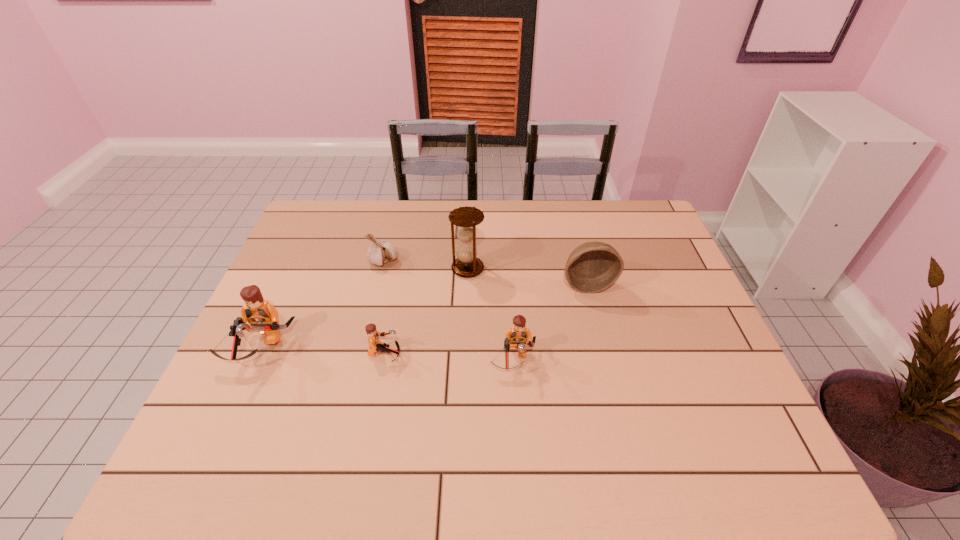
The image size is (960, 540). In order to click on free area in between the fifth object from left to right and the garlic in this screenshot , I will do `click(448, 310)`.

Locate an element on the screen. object that can be found as the fourth closest to the second tallest Lego is located at coordinates (380, 252).

Image resolution: width=960 pixels, height=540 pixels. In order to click on the second closest object to the second Lego from left to right in this screenshot , I will do `click(518, 334)`.

You are a GUI agent. You are given a task and a screenshot of the screen. Output one action in this format:
    pyautogui.click(x=<x>, y=<y>)
    Task: Click on the second closest Lego relative to the fifth object from left to right
    Image resolution: width=960 pixels, height=540 pixels.
    Given the screenshot: What is the action you would take?
    pyautogui.click(x=263, y=317)

You are a GUI agent. You are given a task and a screenshot of the screen. Output one action in this format:
    pyautogui.click(x=<x>, y=<y>)
    Task: Click on the Lego that stands as the second closest to the bowl
    The height and width of the screenshot is (540, 960).
    Given the screenshot: What is the action you would take?
    pyautogui.click(x=375, y=345)